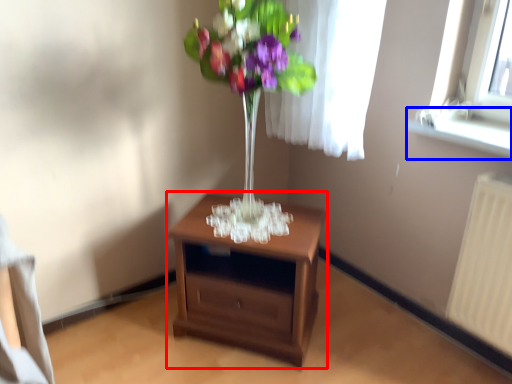
Question: Which object is closer to the camera taking this photo, nightstand (highlighted by a red box) or window sill (highlighted by a blue box)?

Choices:
 (A) nightstand
 (B) window sill

Answer: (B)